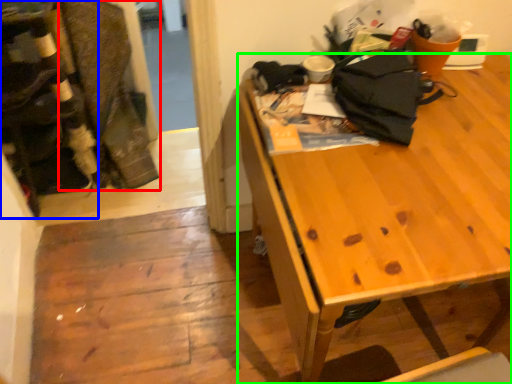
Question: Which is nearer to the laundry (highlighted by a red box)? leftover (highlighted by a blue box) or desk (highlighted by a green box).

Choices:
 (A) leftover
 (B) desk

Answer: (A)